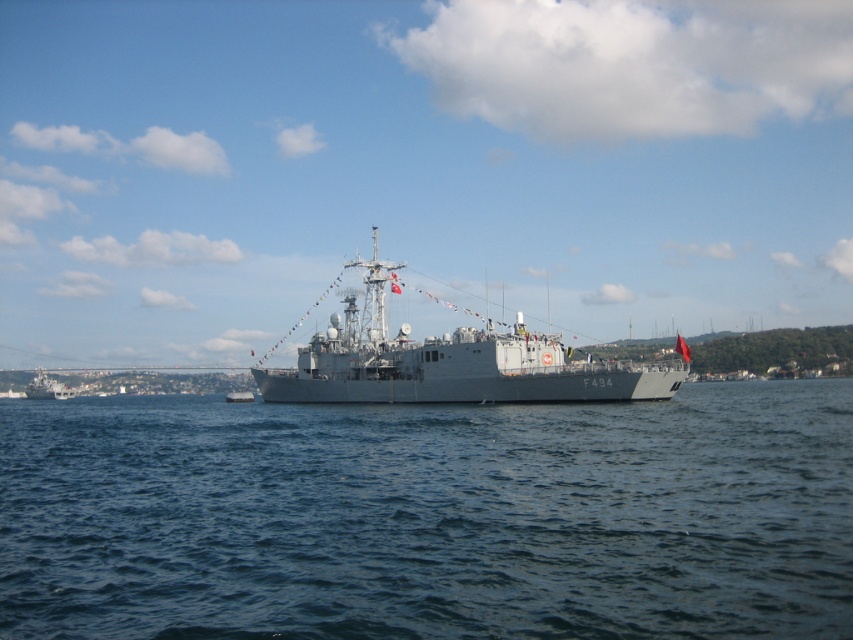
Who is more forward, (343,365) or (41,369)?

Point (343,365)

Does point (338, 396) come closer to viewer compared to point (32, 380)?

Yes, point (338, 396) is closer to viewer.

Image resolution: width=853 pixels, height=640 pixels. Identify the location of gray metallic ship at center. (447, 362).

Who is higher up, blue water at center or gray metallic ship at left?

blue water at center is above.

Is point (732, 621) less distant than point (50, 394)?

Yes, point (732, 621) is in front of point (50, 394).

Is point (247, 404) behind point (32, 392)?

That is False.

Locate an element on the screen. The image size is (853, 640). blue water at center is located at coordinates (430, 516).

Is point (61, 477) less distant than point (508, 378)?

Yes, point (61, 477) is closer to viewer.

At what (x,y) coordinates should I click in order to perform the action: click on blue water at center. Please return your answer as a coordinate pair (x, y). Looking at the image, I should click on (430, 516).